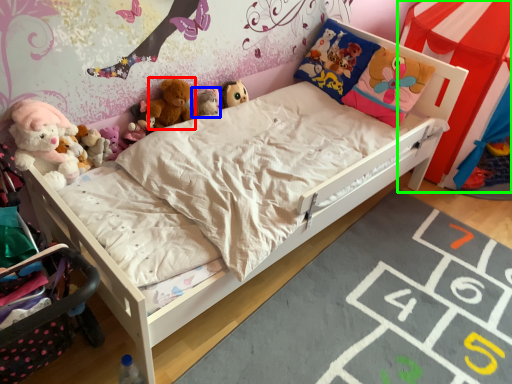
Question: Which is nearer to the toy (highlighted by a red box)? toy (highlighted by a blue box) or canopy bed (highlighted by a green box).

Choices:
 (A) toy
 (B) canopy bed

Answer: (A)